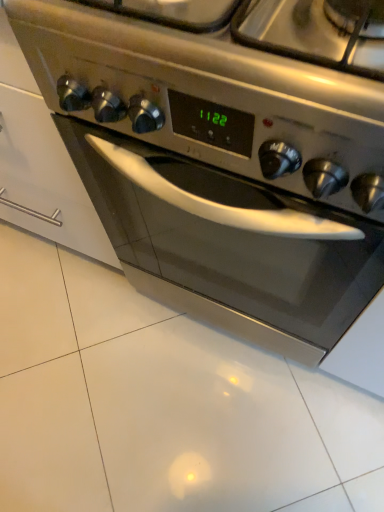
Image resolution: width=384 pixels, height=512 pixels. I want to click on stainless steel oven at center, so click(219, 170).

Describe the element at coordinates (219, 170) in the screenshot. I see `stainless steel oven at center` at that location.

This screenshot has width=384, height=512. Find the location of `stainless steel oven at center`. stainless steel oven at center is located at coordinates (219, 170).